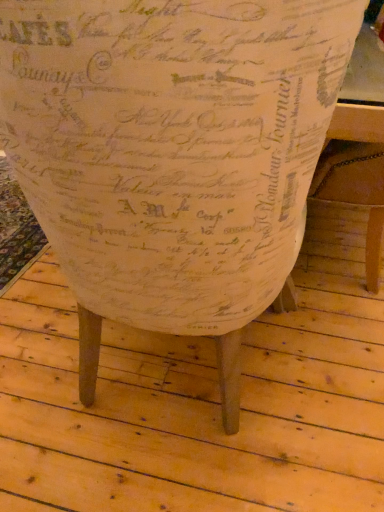
What is the approximate height of white paper flowerpot at center?

white paper flowerpot at center is 37.77 inches in height.

Identify the location of white paper flowerpot at center. The height and width of the screenshot is (512, 384). (171, 145).

Image resolution: width=384 pixels, height=512 pixels. Describe the element at coordinates (171, 145) in the screenshot. I see `white paper flowerpot at center` at that location.

Locate an element on the screen. Image resolution: width=384 pixels, height=512 pixels. white paper flowerpot at center is located at coordinates (171, 145).